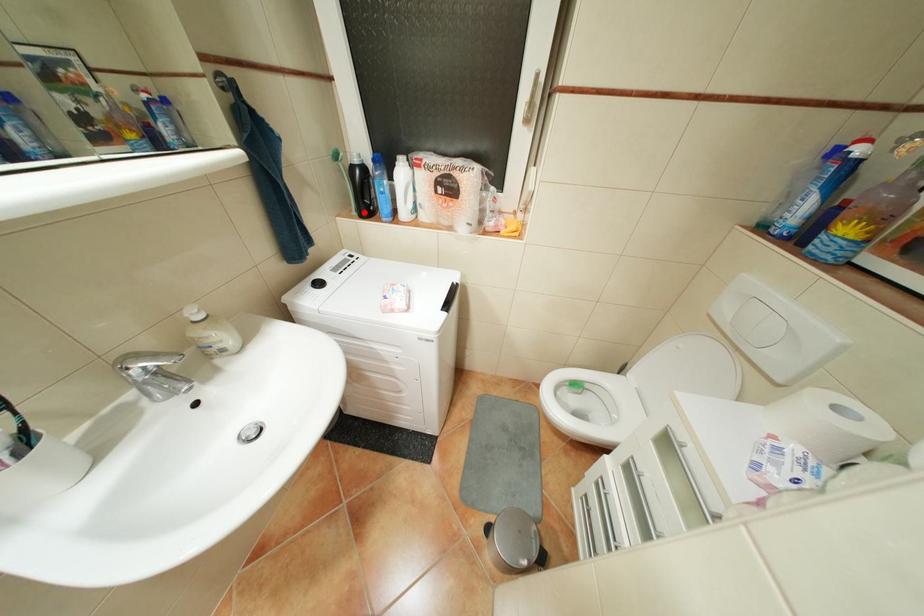
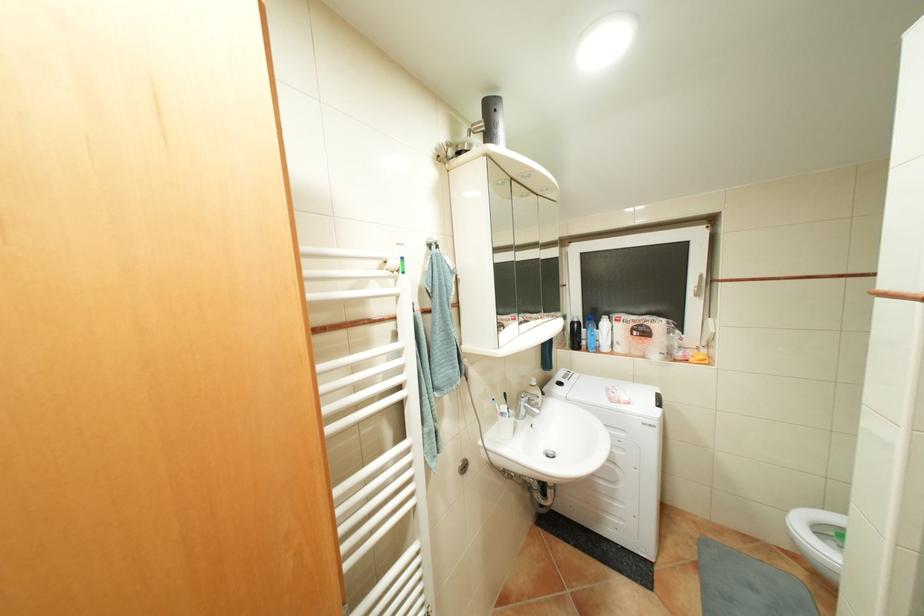
Question: I am providing you with two images of the same scene from different viewpoints. Given a red point in image1, look at the same physical point in image2. Is it:

Choices:
 (A) Closer to the viewpoint
 (B) Farther from the viewpoint

Answer: (B)